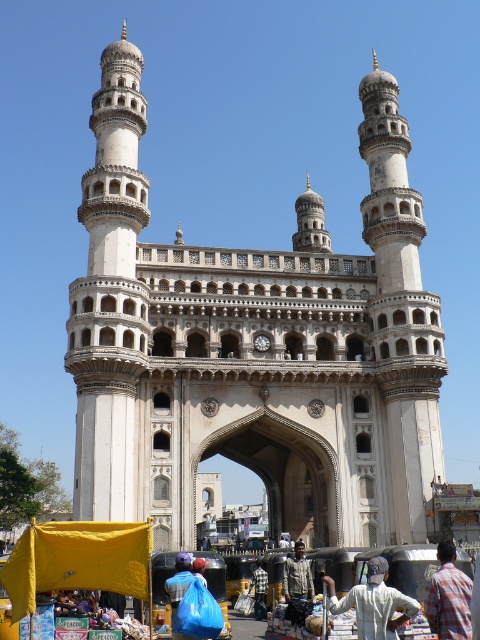
What do you see at coordinates (373, 602) in the screenshot? Image resolution: width=480 pixels, height=640 pixels. I see `white cotton shirt at center` at bounding box center [373, 602].

You are a GUI agent. You are given a task and a screenshot of the screen. Output one action in this format:
    pyautogui.click(x=<x>, y=<y>)
    Task: Click on the white cotton shirt at center
    The image size is (480, 640).
    Given the screenshot: What is the action you would take?
    pyautogui.click(x=373, y=602)

What are the coordinates of `white cotton shirt at center` in the screenshot? It's located at (373, 602).

Is white cotton shirt at center shorter than plaid fabric shirt at lower right?

Indeed, white cotton shirt at center has a lesser height compared to plaid fabric shirt at lower right.

Who is lower down, white cotton shirt at center or plaid fabric shirt at lower right?

Positioned lower is white cotton shirt at center.

You are a GUI agent. You are given a task and a screenshot of the screen. Output one action in this format:
    pyautogui.click(x=<x>, y=<y>)
    Task: Click on the white cotton shirt at center
    Image resolution: width=480 pixels, height=640 pixels.
    Given the screenshot: What is the action you would take?
    pyautogui.click(x=373, y=602)

Locate an element on the screen. The height and width of the screenshot is (640, 480). white cotton shirt at center is located at coordinates (373, 602).

I want to click on plaid fabric shirt at lower right, so click(x=448, y=596).

Which is above, plaid fabric shirt at lower right or dark gray textured shirt at center?

Positioned higher is plaid fabric shirt at lower right.

Is point (447, 570) farther from camera compared to point (284, 588)?

No, it is not.

Locate an element on the screen. The width and height of the screenshot is (480, 640). plaid fabric shirt at lower right is located at coordinates (448, 596).